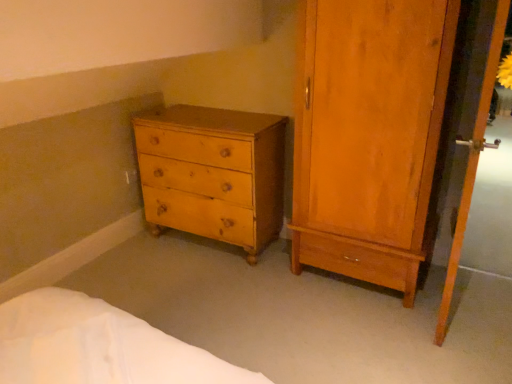
What are the coordinates of `vacant space that is in between wooden screen door at right and matte wood wardrobe at right` in the screenshot? It's located at (369, 313).